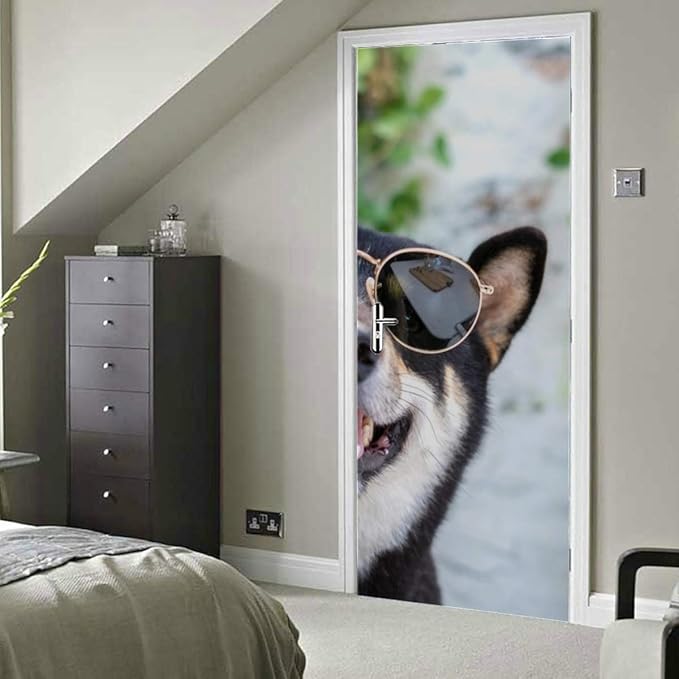
Where is `chair seat`? chair seat is located at coordinates (610, 631).